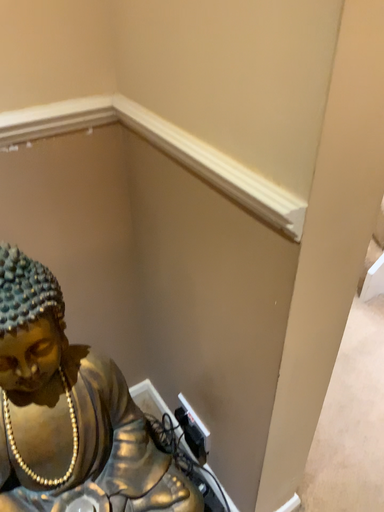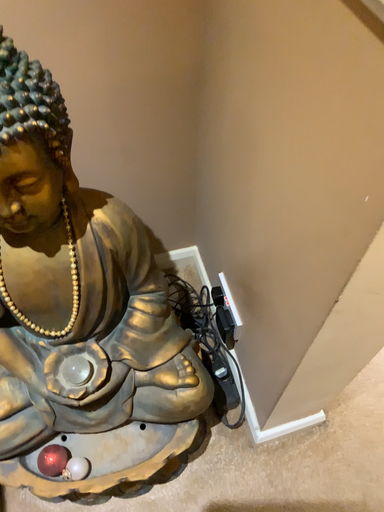
Question: Which way did the camera rotate in the video?

Choices:
 (A) rotated downward
 (B) rotated upward

Answer: (A)